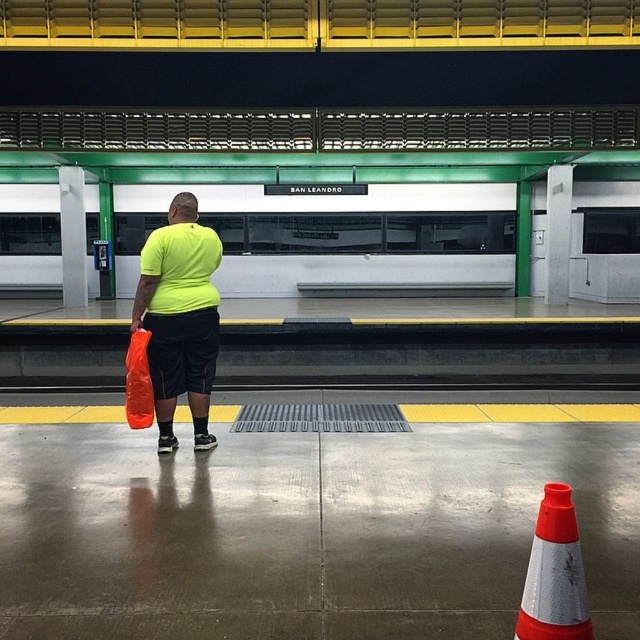
You are standing on the platform and want to board the green matte subway at center. Where should you position yourself to board it?

You should position yourself at point (353, 241) to board the green matte subway at center.

You are a person standing on the platform and you want to pick up both the orange reflective cone at lower right and the orange matte shopping bag at lower left. Which one should you move towards first to reach the closest one?

The orange matte shopping bag at lower left is closer because it is to the left of the orange reflective cone at lower right, so you should move towards the orange matte shopping bag at lower left first.